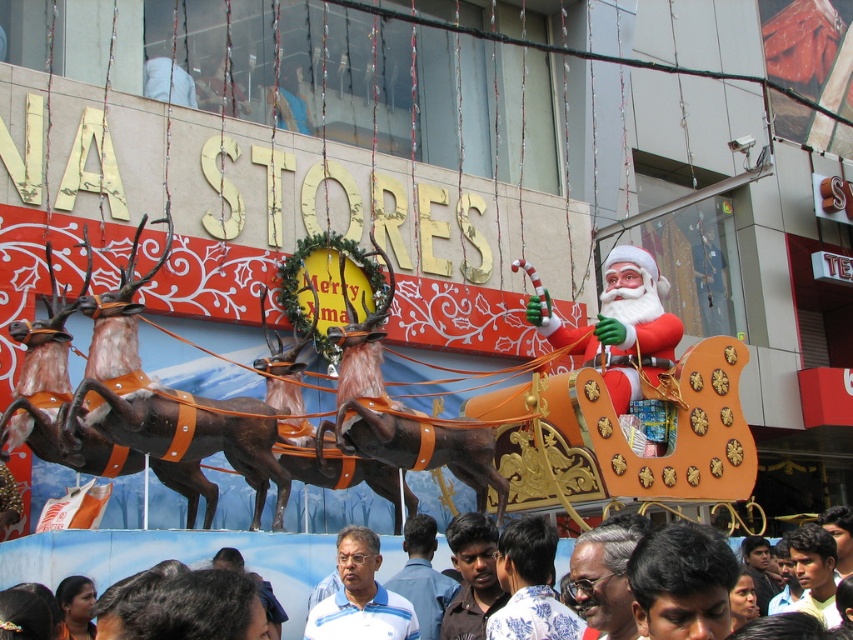
Question: Considering the real-world distances, which object is closest to the blue shirt at center?

Choices:
 (A) light brown hair at lower right
 (B) brown textured shirt at lower center

Answer: (B)

Question: Does white fabric shirt at lower center come behind light brown hair at lower right?

Choices:
 (A) yes
 (B) no

Answer: (A)

Question: Is brown textured shirt at lower center bigger than light brown hair at lower right?

Choices:
 (A) yes
 (B) no

Answer: (B)

Question: Among these objects, which one is nearest to the camera?

Choices:
 (A) gray hair glasses at center
 (B) blue shirt at center
 (C) brown textured shirt at lower center
 (D) floral shirt at center

Answer: (A)

Question: Among these points, which one is nearest to the camera?

Choices:
 (A) (486, 600)
 (B) (614, 573)

Answer: (B)

Question: Can you confirm if red glossy santa claus at center is positioned to the left of white fabric shirt at lower center?

Choices:
 (A) yes
 (B) no

Answer: (B)